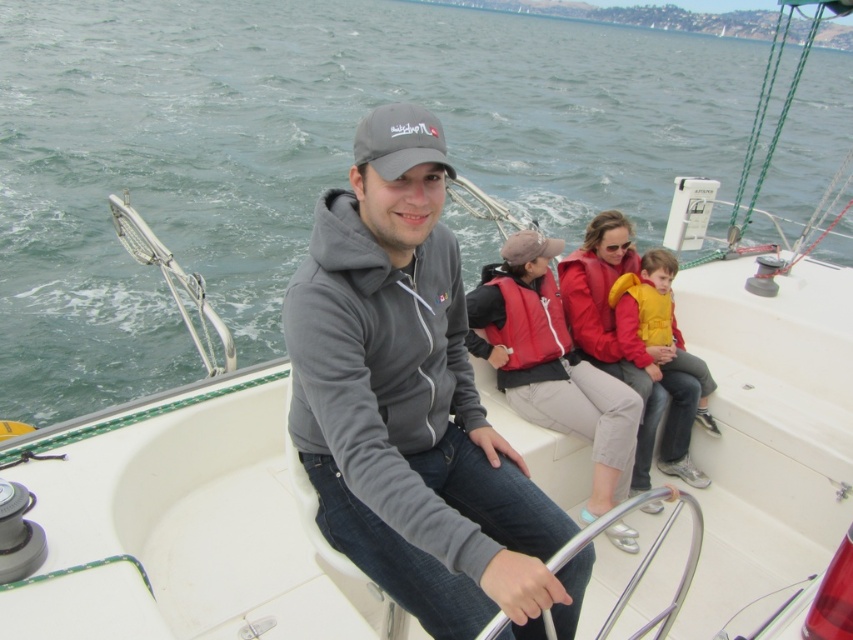
Question: Which point appears farthest from the camera in this image?

Choices:
 (A) (611, 227)
 (B) (637, 490)

Answer: (A)

Question: Can you confirm if green water at center is positioned to the right of matte red life vest at center?

Choices:
 (A) no
 (B) yes

Answer: (B)

Question: Which of the following is the closest to the observer?

Choices:
 (A) yellow fleece vest at center
 (B) gray hoodie at center

Answer: (B)

Question: Does gray hoodie at center appear over yellow fleece vest at center?

Choices:
 (A) no
 (B) yes

Answer: (A)

Question: Observing the image, what is the correct spatial positioning of green water at center in reference to yellow fleece vest at center?

Choices:
 (A) right
 (B) left

Answer: (A)

Question: Which of the following is the closest to the observer?

Choices:
 (A) [592, 340]
 (B) [306, 260]
 (C) [262, 156]
 (D) [730, 602]

Answer: (B)